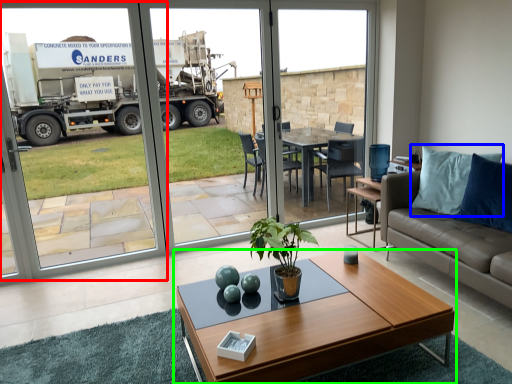
Question: Considering the real-world distances, which object is closest to screen door (highlighted by a red box)? pillow (highlighted by a blue box) or coffee table (highlighted by a green box).

Choices:
 (A) pillow
 (B) coffee table

Answer: (B)